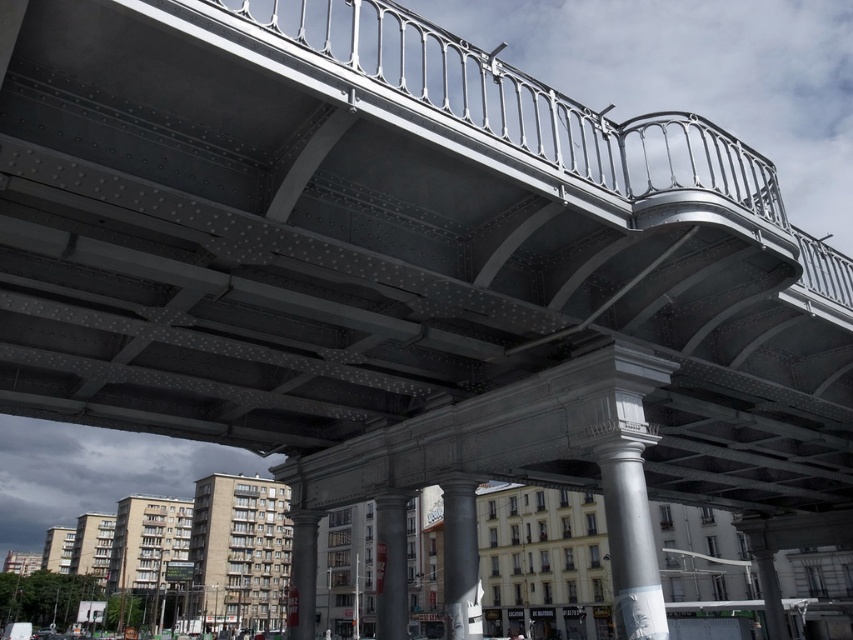
You are an architect examining the bridge structure. You notice the white polished stone column at center and the smooth concrete pillar at center. Which of these two columns is located to the right when viewed from underneath the bridge?

The white polished stone column at center is positioned on the right side of the smooth concrete pillar at center, so it is located to the right when viewed from underneath the bridge.

You are standing directly below the bridge and looking upward. You notice two points marked as point (468, 596) and point (306, 557). Which point appears closer to your eyes?

Point (468, 596) is closer to the camera than point (306, 557), so it appears closer to your eyes.

You are standing underneath the bridge and notice two points marked on the structure. The first point is at coordinates point [610,488] and the second is at point [468,576]. Which point is nearer to your current position?

Point [610,488] is closer to the camera than point [468,576], so the first point is nearer to your current position.